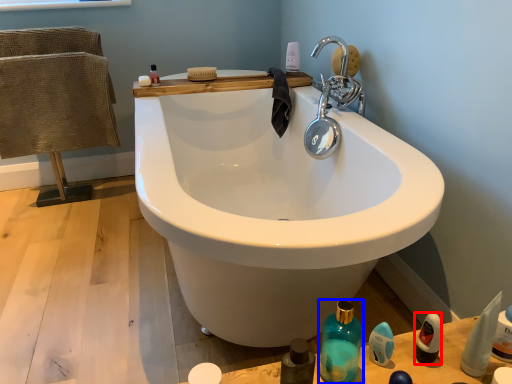
Question: Which object appears farthest to the camera in this image, mouthwash (highlighted by a red box) or bottle (highlighted by a blue box)?

Choices:
 (A) mouthwash
 (B) bottle

Answer: (A)